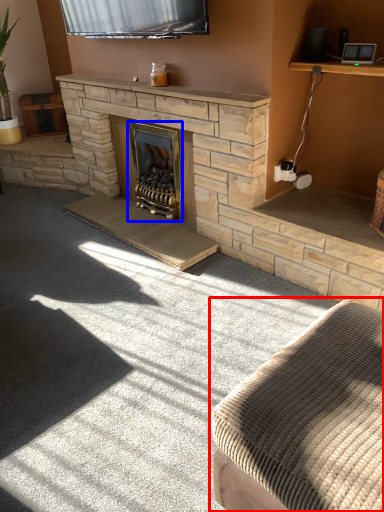
Question: Which object appears farthest to the camera in this image, studio couch (highlighted by a red box) or wood burning stove (highlighted by a blue box)?

Choices:
 (A) studio couch
 (B) wood burning stove

Answer: (B)